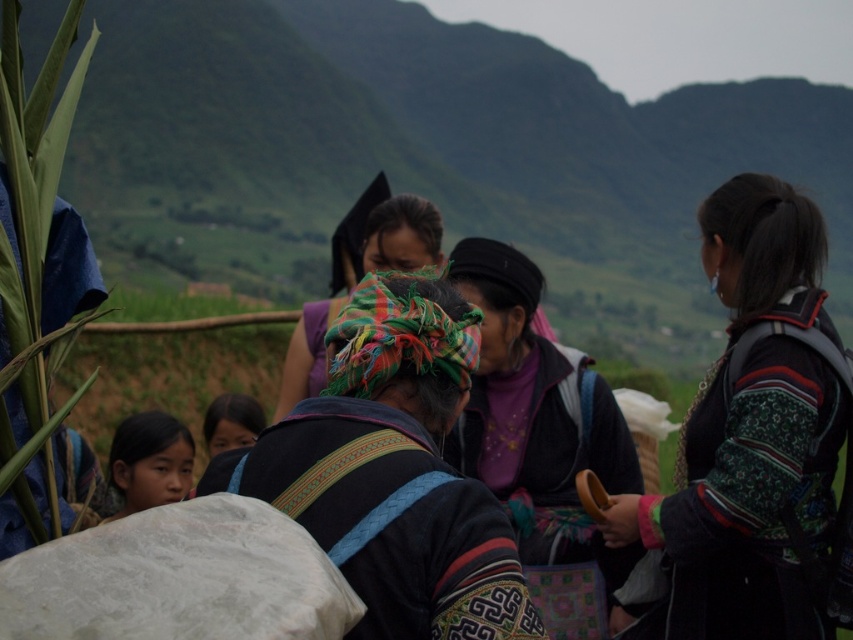
Does green patterned sweater at right appear over green woven cloth at lower left?

Incorrect, green patterned sweater at right is not positioned above green woven cloth at lower left.

Looking at this image, is the position of green patterned sweater at right less distant than that of green woven cloth at lower left?

No, green patterned sweater at right is behind green woven cloth at lower left.

Does point (706, 520) lie behind point (117, 384)?

No, it is in front of (117, 384).

Image resolution: width=853 pixels, height=640 pixels. What are the coordinates of `green patterned sweater at right` in the screenshot? It's located at (752, 435).

What do you see at coordinates (752, 435) in the screenshot? I see `green patterned sweater at right` at bounding box center [752, 435].

Is point (724, 301) closer to viewer compared to point (462, 372)?

No, it is behind (462, 372).

Which is behind, point (759, 486) or point (373, 573)?

Point (759, 486)

This screenshot has width=853, height=640. In order to click on green patterned sweater at right in this screenshot , I will do `click(752, 435)`.

Is purple fabric at center wider than matte black headscarf at lower center?

No.

Who is more distant from viewer, (494,400) or (236,394)?

The point (236,394) is more distant.

I want to click on purple fabric at center, so click(x=538, y=420).